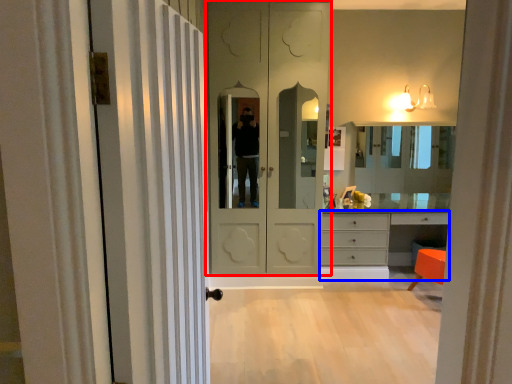
Question: Which object is closer to the camera taking this photo, door (highlighted by a red box) or chest of drawers (highlighted by a blue box)?

Choices:
 (A) door
 (B) chest of drawers

Answer: (A)